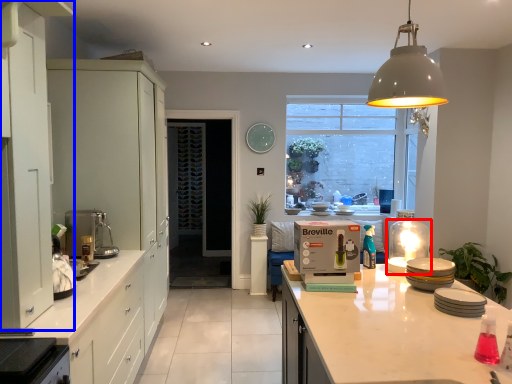
Question: Which of the following is the farthest to the observer, appliance (highlighted by a red box) or cabinetry (highlighted by a blue box)?

Choices:
 (A) appliance
 (B) cabinetry

Answer: (A)